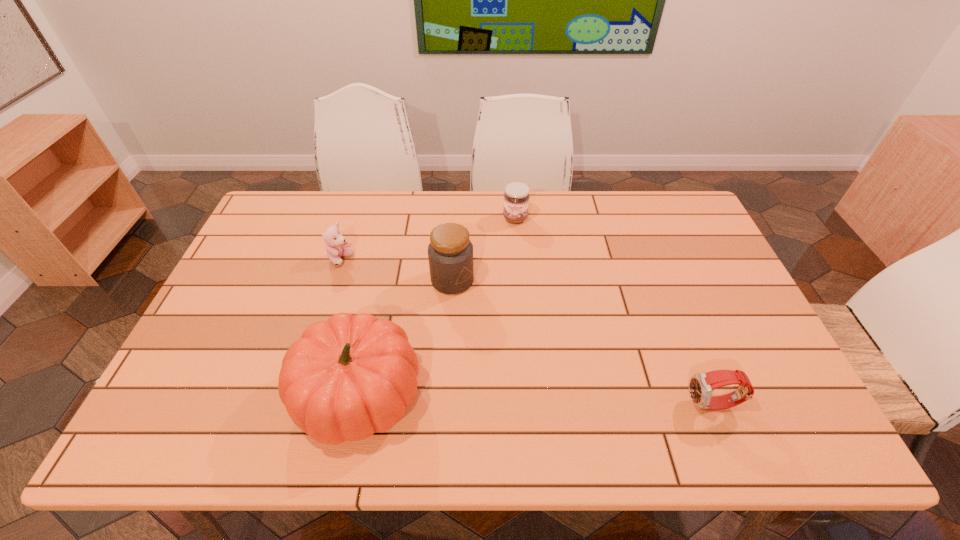
Where is `free space between the second object from right to left and the rightmost object`? Image resolution: width=960 pixels, height=540 pixels. free space between the second object from right to left and the rightmost object is located at coordinates (614, 312).

I want to click on free space between the farthest object and the jar, so click(484, 249).

Where is `vacant space in between the jam and the teddy bear`? The width and height of the screenshot is (960, 540). vacant space in between the jam and the teddy bear is located at coordinates (428, 239).

Where is `blank region between the pumpkin and the rightmost object`? blank region between the pumpkin and the rightmost object is located at coordinates (535, 400).

At what (x,y) coordinates should I click in order to perform the action: click on vacant point located between the teddy bear and the jam. Please return your answer as a coordinate pair (x, y). The image size is (960, 540). Looking at the image, I should click on (428, 239).

The image size is (960, 540). In order to click on vacant area between the jar and the farthest object in this screenshot , I will do `click(484, 249)`.

Find the location of a particular element. The height and width of the screenshot is (540, 960). empty space that is in between the farthest object and the jar is located at coordinates (484, 249).

Locate an element on the screen. vacant area between the jar and the rightmost object is located at coordinates (583, 343).

Choose which object is the nearest neighbor to the jam. Please provide its 2D coordinates. Your answer should be formatted as a tuple, i.e. [(x, y)], where the tuple contains the x and y coordinates of a point satisfying the conditions above.

[(450, 253)]

The width and height of the screenshot is (960, 540). In order to click on object that ranks as the second closest to the rightmost object in this screenshot , I will do `click(344, 379)`.